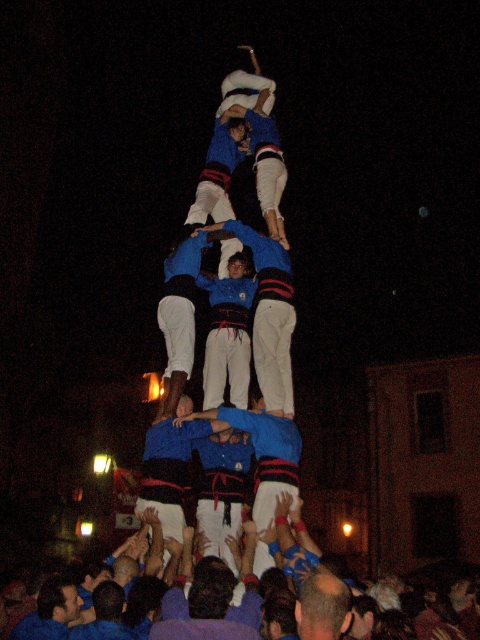
Question: Among these points, which one is nearest to the camera?

Choices:
 (A) (230, 374)
 (B) (334, 605)
 (C) (280, 292)

Answer: (B)

Question: Does blue fabric pants at center appear on the left side of white cotton pants at center?

Choices:
 (A) no
 (B) yes

Answer: (A)

Question: Is blue fabric pants at center thinner than white cotton pants at center?

Choices:
 (A) no
 (B) yes

Answer: (A)

Question: Which of the following is the closest to the observer?

Choices:
 (A) (304, 625)
 (B) (262, 364)

Answer: (A)

Question: Can you confirm if blue fabric pants at center is positioned to the right of white cotton pants at center?

Choices:
 (A) yes
 (B) no

Answer: (A)

Question: Among these objects, which one is farthest from the camera?

Choices:
 (A) blue fabric pants at center
 (B) white cotton pants at center
 (C) bald head at center

Answer: (B)